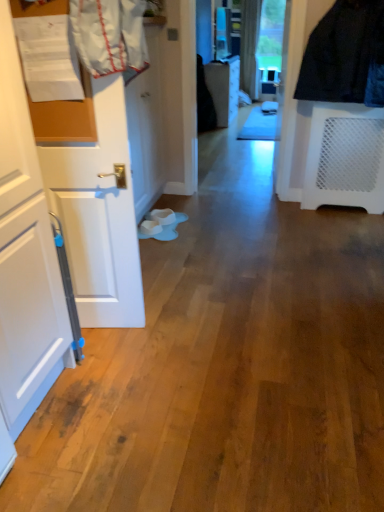
You are a GUI agent. You are given a task and a screenshot of the screen. Output one action in this format:
    pyautogui.click(x=<x>, y=<y>)
    Task: Click on the vacant region below white matte door at left, positioned as the 1th door in front-to-back order (from a real-world perspective)
    
    Given the screenshot: What is the action you would take?
    pyautogui.click(x=113, y=330)